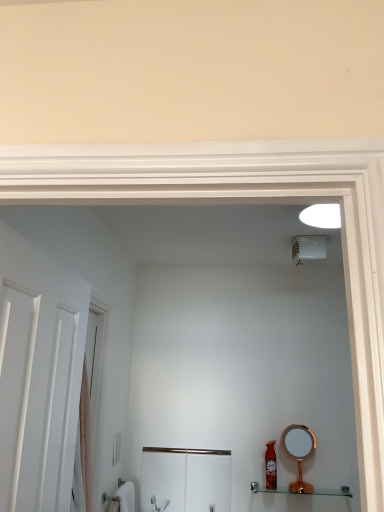
The height and width of the screenshot is (512, 384). Identify the location of brushed metal cabinet at lower center, placed as the 2th screen door when sorted from front to back. (186, 478).

The image size is (384, 512). What do you see at coordinates (116, 448) in the screenshot?
I see `white plastic light switch at lower left` at bounding box center [116, 448].

This screenshot has width=384, height=512. Describe the element at coordinates (298, 453) in the screenshot. I see `copper metallic mirror at lower right` at that location.

What is the approximate width of pink fabric screen door at left, the 2th screen door in the right-to-left sequence?

pink fabric screen door at left, the 2th screen door in the right-to-left sequence, is 4.65 inches in width.

What is the approximate height of white matte door at left?

The height of white matte door at left is 28.49 inches.

At what (x,y) coordinates should I click in order to perform the action: click on brushed metal cabinet at lower center, the 2th screen door when ordered from top to bottom. Please return your answer as a coordinate pair (x, y). The width and height of the screenshot is (384, 512). Looking at the image, I should click on (186, 478).

Would you say white plastic light switch at lower left contains clear glass shelf at lower right?

No, white plastic light switch at lower left does not contain clear glass shelf at lower right.

The height and width of the screenshot is (512, 384). Identify the location of shelf located underneath the white plastic light switch at lower left (from a real-world perspective). (331, 492).

Is white plastic light switch at lower left smaller than clear glass shelf at lower right?

Yes, white plastic light switch at lower left is smaller than clear glass shelf at lower right.

Looking at their sizes, would you say brushed metal cabinet at lower center, which is counted as the first screen door, starting from the back, is wider or thinner than shiny red bottle at lower right?

Clearly, brushed metal cabinet at lower center, which is counted as the first screen door, starting from the back, has less width compared to shiny red bottle at lower right.

Is brushed metal cabinet at lower center, the 2th screen door from the left, not inside shiny red bottle at lower right?

brushed metal cabinet at lower center, the 2th screen door from the left, is positioned outside shiny red bottle at lower right.

Is brushed metal cabinet at lower center, placed as the 2th screen door when sorted from front to back, not near shiny red bottle at lower right?

No, there isn't a large distance between brushed metal cabinet at lower center, placed as the 2th screen door when sorted from front to back, and shiny red bottle at lower right.

Is shiny red bottle at lower right turned away from pink fabric screen door at left, the first screen door positioned from the top?

shiny red bottle at lower right is not turned away from pink fabric screen door at left, the first screen door positioned from the top.

Does shiny red bottle at lower right come behind pink fabric screen door at left, positioned as the 2th screen door in bottom-to-top order?

Yes, the depth of shiny red bottle at lower right is greater than that of pink fabric screen door at left, positioned as the 2th screen door in bottom-to-top order.

Considering the relative sizes of shiny red bottle at lower right and pink fabric screen door at left, the first screen door positioned from the top, in the image provided, is shiny red bottle at lower right thinner than pink fabric screen door at left, the first screen door positioned from the top,?

Correct, the width of shiny red bottle at lower right is less than that of pink fabric screen door at left, the first screen door positioned from the top.

Does shiny red bottle at lower right contain pink fabric screen door at left, the first screen door positioned from the top?

Definitely not — pink fabric screen door at left, the first screen door positioned from the top, is not inside shiny red bottle at lower right.

Which is closer to the camera, (329, 493) or (273, 455)?

Point (329, 493) appears to be closer to the viewer than point (273, 455).

What's the angular difference between clear glass shelf at lower right and shiny red bottle at lower right's facing directions?

The angle between the facing direction of clear glass shelf at lower right and the facing direction of shiny red bottle at lower right is 0.552 degrees.

From the image's perspective, is clear glass shelf at lower right beneath shiny red bottle at lower right?

Yes.

Image resolution: width=384 pixels, height=512 pixels. Identify the location of toiletry that appears on the left of clear glass shelf at lower right. (270, 466).

Is there a large distance between copper metallic mirror at lower right and shiny red bottle at lower right?

That's not correct — copper metallic mirror at lower right is a little close to shiny red bottle at lower right.

Considering the relative sizes of copper metallic mirror at lower right and shiny red bottle at lower right in the image provided, is copper metallic mirror at lower right shorter than shiny red bottle at lower right?

No.

Which object is positioned more to the right, copper metallic mirror at lower right or shiny red bottle at lower right?

Positioned to the right is copper metallic mirror at lower right.

The height and width of the screenshot is (512, 384). In order to click on toiletry directly beneath the copper metallic mirror at lower right (from a real-world perspective) in this screenshot , I will do `click(270, 466)`.

From the image's perspective, would you say shiny red bottle at lower right is positioned over copper metallic mirror at lower right?

No, from the image's perspective, shiny red bottle at lower right is not over copper metallic mirror at lower right.

Looking at this image, is shiny red bottle at lower right spatially inside copper metallic mirror at lower right, or outside of it?

shiny red bottle at lower right is located beyond the bounds of copper metallic mirror at lower right.

Is shiny red bottle at lower right positioned far away from copper metallic mirror at lower right?

Actually, shiny red bottle at lower right and copper metallic mirror at lower right are a little close together.

From a real-world perspective, which is physically above, shiny red bottle at lower right or copper metallic mirror at lower right?

copper metallic mirror at lower right, from a real-world perspective.

Which point is more forward, (80, 505) or (299, 454)?

The point (80, 505) is more forward.

Measure the distance from pink fabric screen door at left, positioned as the second screen door in back-to-front order, to copper metallic mirror at lower right.

pink fabric screen door at left, positioned as the second screen door in back-to-front order, is 3.84 feet away from copper metallic mirror at lower right.

Who is smaller, pink fabric screen door at left, placed as the first screen door when sorted from front to back, or copper metallic mirror at lower right?

pink fabric screen door at left, placed as the first screen door when sorted from front to back.

Is pink fabric screen door at left, positioned as the 2th screen door in bottom-to-top order, at the left side of copper metallic mirror at lower right?

Yes, pink fabric screen door at left, positioned as the 2th screen door in bottom-to-top order, is to the left of copper metallic mirror at lower right.

At what (x,y) coordinates should I click in order to perform the action: click on shelf below the white plastic light switch at lower left (from the image's perspective). Please return your answer as a coordinate pair (x, y). This screenshot has height=512, width=384. Looking at the image, I should click on (331, 492).

At what (x,y) coordinates should I click in order to perform the action: click on toiletry that appears on the right of brushed metal cabinet at lower center, placed as the 2th screen door when sorted from front to back. Please return your answer as a coordinate pair (x, y). Looking at the image, I should click on (270, 466).

Which object lies nearer to the anchor point pink fabric screen door at left, positioned as the 2th screen door in bottom-to-top order, brushed metal cabinet at lower center, which is counted as the first screen door, starting from the back, or shiny red bottle at lower right?

brushed metal cabinet at lower center, which is counted as the first screen door, starting from the back, is closer to pink fabric screen door at left, positioned as the 2th screen door in bottom-to-top order.

Looking at the image, which one is located further to white matte door at left, copper metallic mirror at lower right or white plastic light switch at lower left?

copper metallic mirror at lower right is further to white matte door at left.

Looking at the image, which one is located further to clear glass shelf at lower right, shiny red bottle at lower right or brushed metal cabinet at lower center, the 1th screen door ordered from the bottom?

brushed metal cabinet at lower center, the 1th screen door ordered from the bottom, is further to clear glass shelf at lower right.

Considering their positions, is pink fabric screen door at left, the first screen door positioned from the top, positioned further to white matte door at left than brushed metal cabinet at lower center, which is counted as the first screen door, starting from the back?

brushed metal cabinet at lower center, which is counted as the first screen door, starting from the back.

Based on the photo, based on their spatial positions, is shiny red bottle at lower right or copper metallic mirror at lower right closer to pink fabric screen door at left, positioned as the 2th screen door in bottom-to-top order?

shiny red bottle at lower right lies closer to pink fabric screen door at left, positioned as the 2th screen door in bottom-to-top order, than the other object.

Based on their spatial positions, is white matte door at left or white plastic light switch at lower left closer to brushed metal cabinet at lower center, the 2th screen door when ordered from top to bottom?

white plastic light switch at lower left is closer to brushed metal cabinet at lower center, the 2th screen door when ordered from top to bottom.

Based on their spatial positions, is shiny red bottle at lower right or clear glass shelf at lower right further from white plastic light switch at lower left?

clear glass shelf at lower right.

From the image, which object appears to be nearer to brushed metal cabinet at lower center, the 2th screen door when ordered from top to bottom, white plastic light switch at lower left or copper metallic mirror at lower right?

Among the two, white plastic light switch at lower left is located nearer to brushed metal cabinet at lower center, the 2th screen door when ordered from top to bottom.

Locate an element on the screen. Image resolution: width=384 pixels, height=512 pixels. shelf located between white matte door at left and brushed metal cabinet at lower center, placed as the 2th screen door when sorted from front to back, in the depth direction is located at coordinates (331, 492).

Image resolution: width=384 pixels, height=512 pixels. Identify the location of screen door between pink fabric screen door at left, which appears as the first screen door when viewed from the left, and clear glass shelf at lower right, in the horizontal direction. (186, 478).

Locate an element on the screen. The image size is (384, 512). light switch located between white matte door at left and copper metallic mirror at lower right in the depth direction is located at coordinates pos(116,448).

Find the location of `screen door between white matte door at left and white plastic light switch at lower left in the front-back direction`. screen door between white matte door at left and white plastic light switch at lower left in the front-back direction is located at coordinates (90, 407).